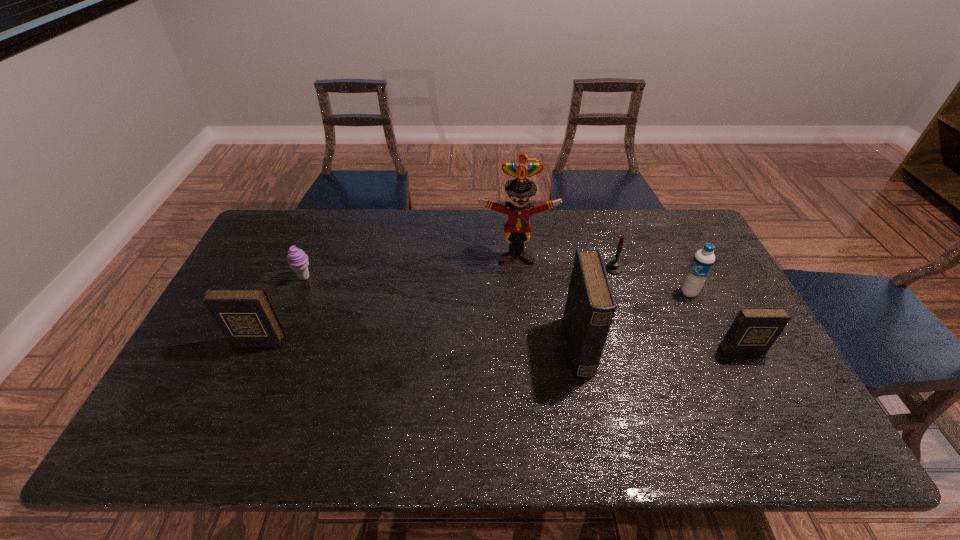
This screenshot has width=960, height=540. Find the location of `the second shortest diary`. the second shortest diary is located at coordinates point(246,317).

This screenshot has width=960, height=540. Identify the location of the second diary from right to left. (590, 306).

Find the location of a particular element. The image size is (960, 540). the second tallest object is located at coordinates (590, 306).

Find the location of a particular element. the shortest diary is located at coordinates (754, 330).

The height and width of the screenshot is (540, 960). In order to click on the fifth object from left to right in this screenshot , I will do coord(614,267).

You are a GUI agent. You are given a task and a screenshot of the screen. Output one action in this format:
    pyautogui.click(x=<x>, y=<y>)
    Task: Click on the tallest object
    The image size is (960, 540).
    Given the screenshot: What is the action you would take?
    pyautogui.click(x=517, y=230)

You are a GUI agent. You are given a task and a screenshot of the screen. Output one action in this format:
    pyautogui.click(x=<x>, y=<y>)
    Task: Click on the icecream
    
    Given the screenshot: What is the action you would take?
    pyautogui.click(x=297, y=259)

Identify the location of the fourth nearest object. (703, 260).

Find the location of a particular element. Image resolution: width=960 pixels, height=540 pixels. vacant space located on the front cover of the second tallest diary is located at coordinates (248, 363).

Where is `free location located on the front cover of the tallest diary`? free location located on the front cover of the tallest diary is located at coordinates (682, 347).